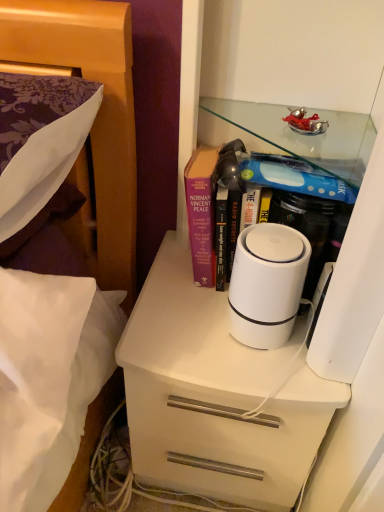
Question: Can you confirm if white matte chest of drawers at center is shorter than hardcover book at center?

Choices:
 (A) yes
 (B) no

Answer: (B)

Question: Can you see white matte chest of drawers at center touching hardcover book at center?

Choices:
 (A) no
 (B) yes

Answer: (A)

Question: Can you confirm if white matte chest of drawers at center is bigger than hardcover book at center?

Choices:
 (A) yes
 (B) no

Answer: (A)

Question: Can you confirm if white matte chest of drawers at center is thinner than hardcover book at center?

Choices:
 (A) no
 (B) yes

Answer: (A)

Question: Is white matte chest of drawers at center oriented away from hardcover book at center?

Choices:
 (A) yes
 (B) no

Answer: (B)

Question: Would you say white matte chest of drawers at center is a long distance from hardcover book at center?

Choices:
 (A) yes
 (B) no

Answer: (B)

Question: Does white matte cylindrical device at center have a lesser width compared to white glossy cabinet at center?

Choices:
 (A) no
 (B) yes

Answer: (B)

Question: From a real-world perspective, is white matte cylindrical device at center physically below white glossy cabinet at center?

Choices:
 (A) yes
 (B) no

Answer: (A)

Question: Is white matte cylindrical device at center facing away from white glossy cabinet at center?

Choices:
 (A) yes
 (B) no

Answer: (A)

Question: Does white matte cylindrical device at center appear on the left side of white glossy cabinet at center?

Choices:
 (A) no
 (B) yes

Answer: (A)

Question: Does white matte cylindrical device at center appear on the right side of white glossy cabinet at center?

Choices:
 (A) yes
 (B) no

Answer: (A)

Question: Considering the relative sizes of white matte cylindrical device at center and white glossy cabinet at center in the image provided, is white matte cylindrical device at center wider than white glossy cabinet at center?

Choices:
 (A) no
 (B) yes

Answer: (A)

Question: From the image's perspective, is white matte cylindrical device at center on white matte chest of drawers at center?

Choices:
 (A) yes
 (B) no

Answer: (A)